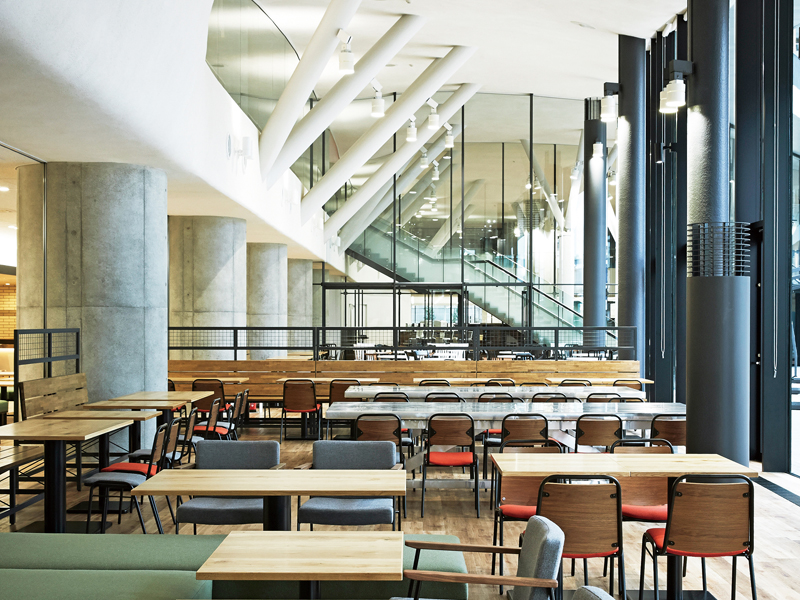
Where is `large concrete pillar`? large concrete pillar is located at coordinates (90, 259), (216, 269), (268, 283), (298, 289), (338, 301).